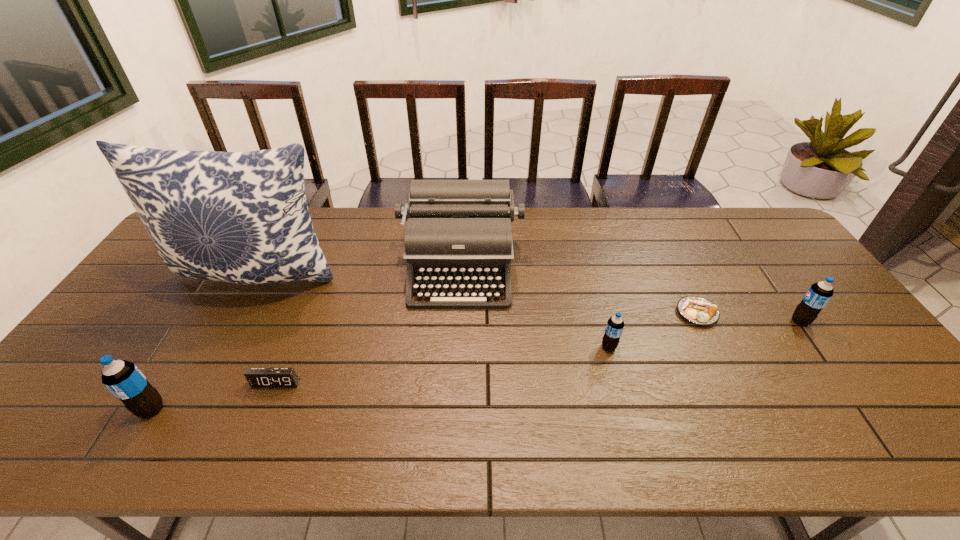
Please point a space for a new pop_(soda) to maintain equal intervals. Please provide its 2D coordinates. Your answer should be formatted as a tuple, i.e. [(x, y)], where the tuple contains the x and y coordinates of a point satisfying the conditions above.

[(394, 376)]